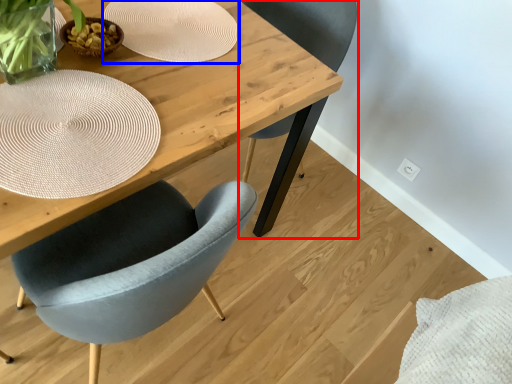
Question: Which object is further to the camera taking this photo, chair (highlighted by a red box) or paper plate (highlighted by a blue box)?

Choices:
 (A) chair
 (B) paper plate

Answer: (A)